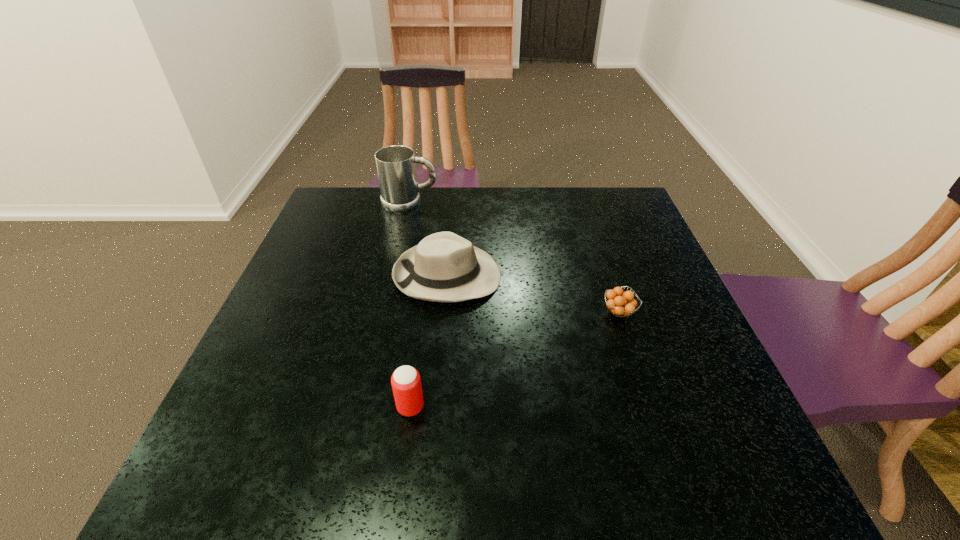
At what (x,y) coordinates should I click in order to perform the action: click on object that is at the far edge. Please return your answer as a coordinate pair (x, y). Looking at the image, I should click on (396, 168).

Find the location of a particular element. The width and height of the screenshot is (960, 540). object located in the right edge section of the desktop is located at coordinates (621, 304).

Find the location of a particular element. This screenshot has width=960, height=540. vacant region at the far edge is located at coordinates (515, 220).

In the image, there is a desktop. Where is `vacant space at the near edge`? The image size is (960, 540). vacant space at the near edge is located at coordinates (345, 478).

Find the location of a particular element. The width and height of the screenshot is (960, 540). free spot at the left edge of the desktop is located at coordinates (301, 289).

Image resolution: width=960 pixels, height=540 pixels. I want to click on vacant space at the right edge of the desktop, so click(x=682, y=394).

You are a GUI agent. You are given a task and a screenshot of the screen. Output one action in this format:
    pyautogui.click(x=<x>, y=<y>)
    Task: Click on the free space at the far left corner of the desktop
    The image size is (960, 540).
    Given the screenshot: What is the action you would take?
    click(328, 203)

The width and height of the screenshot is (960, 540). Find the location of `free space at the near left corner of the desktop`. free space at the near left corner of the desktop is located at coordinates pyautogui.click(x=283, y=491).

Find the location of a particular element. The image size is (960, 540). vacant area between the beer can and the farthest object is located at coordinates (410, 305).

You are a GUI agent. You are given a task and a screenshot of the screen. Output one action in this format:
    pyautogui.click(x=<x>, y=<y>)
    Task: Click on the free point between the nearest object and the tallest object
    Image resolution: width=960 pixels, height=540 pixels.
    Given the screenshot: What is the action you would take?
    pyautogui.click(x=410, y=305)